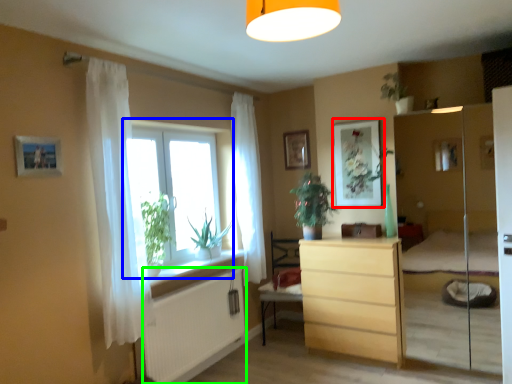
Question: Based on their relative distances, which object is farther from picture frame (highlighted by a red box)? Choose from window (highlighted by a blue box) and radiator (highlighted by a green box).

Choices:
 (A) window
 (B) radiator

Answer: (B)